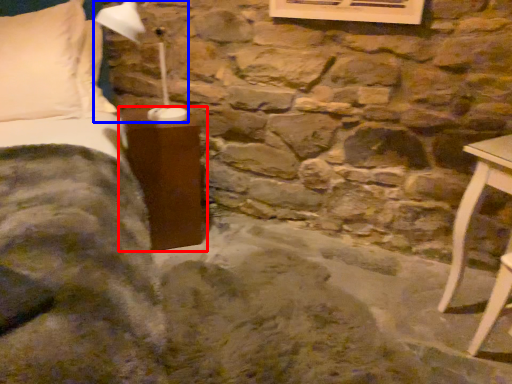
Question: Which of the following is the farthest to the observer, furniture (highlighted by a red box) or table lamp (highlighted by a blue box)?

Choices:
 (A) furniture
 (B) table lamp

Answer: (A)